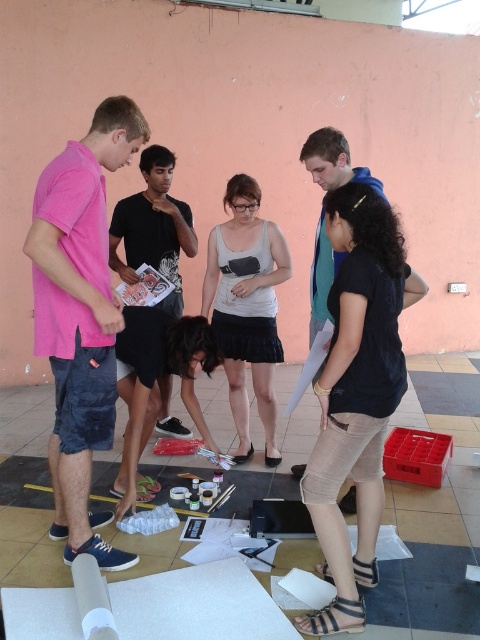
You are a photographer trying to capture a group photo of the matte gray tank top at center and the blue cotton shirt at center. Since you want to ensure both are clearly visible, which one should you focus on first to avoid blurring due to size differences?

The matte gray tank top at center is smaller than the blue cotton shirt at center, so you should focus on the blue cotton shirt at center first to ensure clarity since it takes up more space in the frame.

You are a photographer trying to capture a closeup of the pink cotton shirt at left and the matte gray tank top at center. Since you want both shirts to appear similarly sized in the photo, which subject should you move closer to the camera?

To make both shirts appear similarly sized in the photo, you should move closer to the matte gray tank top at center because it is smaller in size than the pink cotton shirt at left.